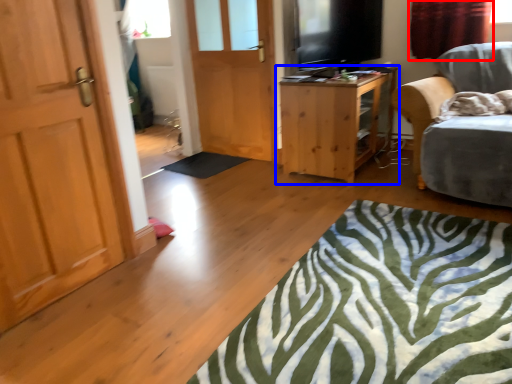
Question: Which object appears farthest to the camera in this image, curtain (highlighted by a red box) or table (highlighted by a blue box)?

Choices:
 (A) curtain
 (B) table

Answer: (A)